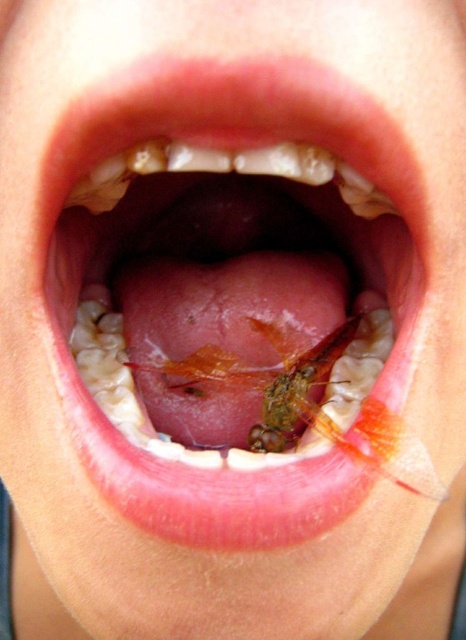
You are a dentist examining a patient. You notice the pink flesh tongue at center and the translucent orange insect at center in the mouth. Which object is taller when viewed from above?

The pink flesh tongue at center is taller than the translucent orange insect at center when viewed from above.

Looking at this image, you are a dentist examining a patient. You notice a point labeled at coordinates [164,205] in the mouth. Based on the scene description, what anatomical structure is located at that point?

The point at coordinates [164,205] indicates the pink flesh tongue at center.

You are a dentist examining a patient. You notice the pink flesh tongue at center and the translucent orange insect at center. Which object is bigger in size?

The pink flesh tongue at center is larger in size compared to the translucent orange insect at center.